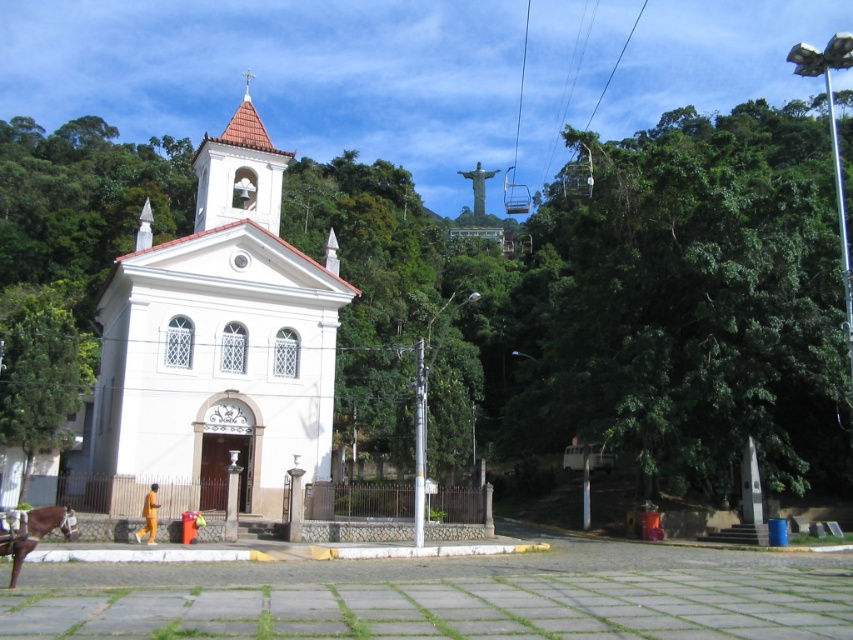
Does white matte church at center have a greater height compared to metallic wire at upper center?

Yes.

What do you see at coordinates (218, 339) in the screenshot?
I see `white matte church at center` at bounding box center [218, 339].

This screenshot has width=853, height=640. What are the coordinates of `white matte church at center` in the screenshot? It's located at (218, 339).

Is green leafy tree at upper right positioned before metallic wire at upper center?

That is True.

Is point (672, 396) in front of point (633, 22)?

Yes, it is.

This screenshot has height=640, width=853. What are the coordinates of `green leafy tree at upper right` in the screenshot? It's located at (689, 305).

Between point (334, 301) and point (67, 532), which one is positioned behind?

The point (334, 301) is more distant.

Image resolution: width=853 pixels, height=640 pixels. I want to click on white matte church at center, so click(x=218, y=339).